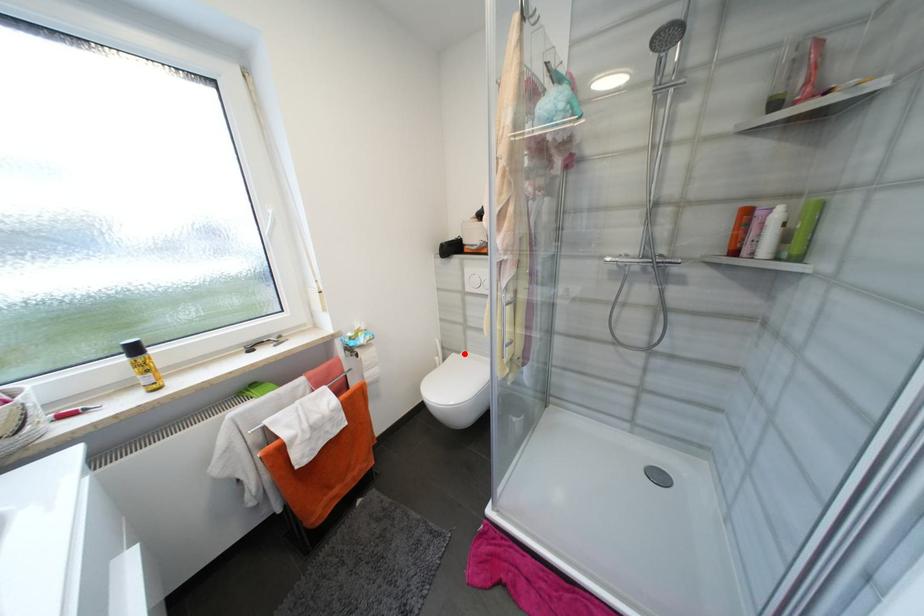
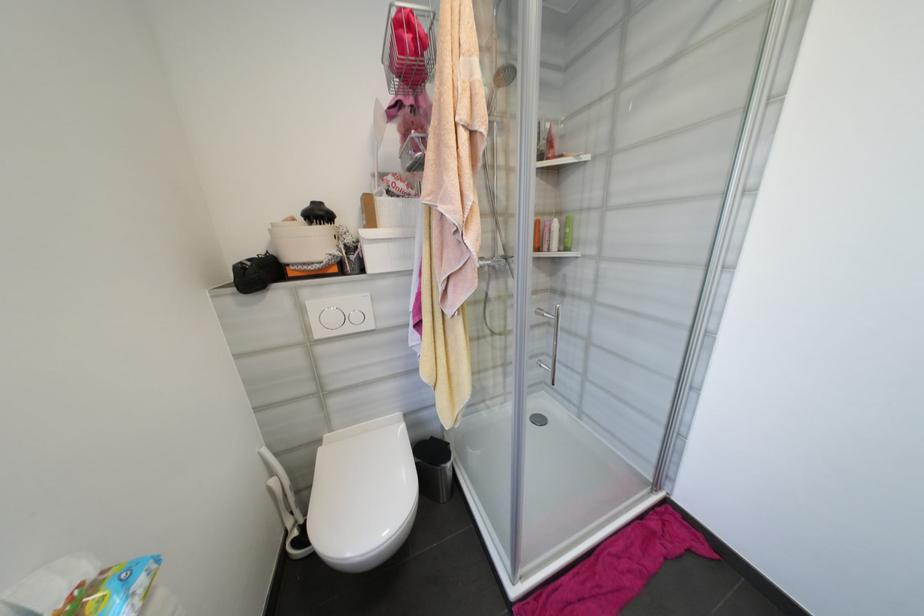
Question: A red point is marked in image1. In image2, is the corresponding 3D point closer to the camera or farther? Reply with the corresponding letter.

Choices:
 (A) The corresponding 3D point is closer.
 (B) The corresponding 3D point is farther.

Answer: (A)